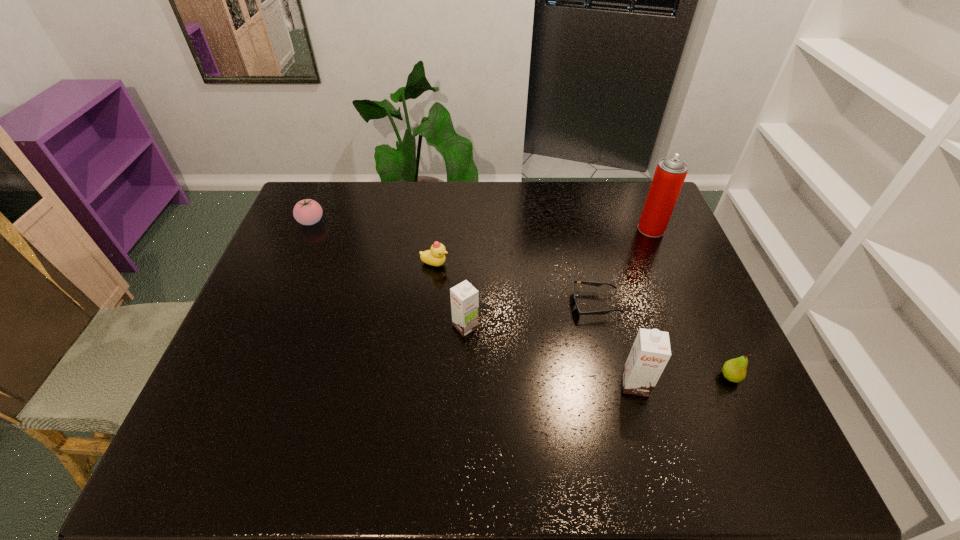
Image resolution: width=960 pixels, height=540 pixels. What are the coordinates of `vacant place for an extra chocolate milk on the left` in the screenshot? It's located at (327, 279).